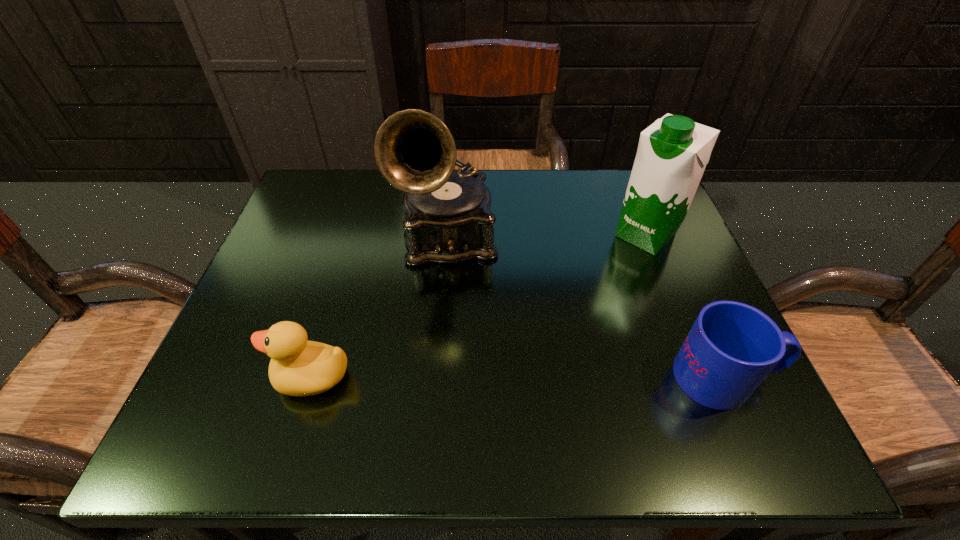
This screenshot has height=540, width=960. Identify the location of free space between the soya milk and the tallest object. (547, 236).

Where is `free point between the phonograph record and the mug`? The height and width of the screenshot is (540, 960). free point between the phonograph record and the mug is located at coordinates (587, 307).

The image size is (960, 540). Find the location of `blank region between the duck and the mug`. blank region between the duck and the mug is located at coordinates (519, 377).

This screenshot has width=960, height=540. I want to click on vacant area between the third object from right to left and the duck, so click(381, 307).

Where is `vacant space in between the duck and the third shortest object`? The image size is (960, 540). vacant space in between the duck and the third shortest object is located at coordinates [x=480, y=306].

At what (x,y) coordinates should I click in order to perform the action: click on free space between the soya milk and the tallest object. Please return your answer as a coordinate pair (x, y). This screenshot has height=540, width=960. Looking at the image, I should click on pyautogui.click(x=547, y=236).

Locate an element on the screen. The width and height of the screenshot is (960, 540). free space that is in between the third shortest object and the mug is located at coordinates (685, 306).

Identify the location of free space between the soya milk and the duck. (480, 306).

Where is `the second closest object to the mug`? The width and height of the screenshot is (960, 540). the second closest object to the mug is located at coordinates (448, 220).

Select which object appears as the second closest to the phonograph record. Please provide its 2D coordinates. Your answer should be formatted as a tuple, i.e. [(x, y)], where the tuple contains the x and y coordinates of a point satisfying the conditions above.

[(672, 154)]